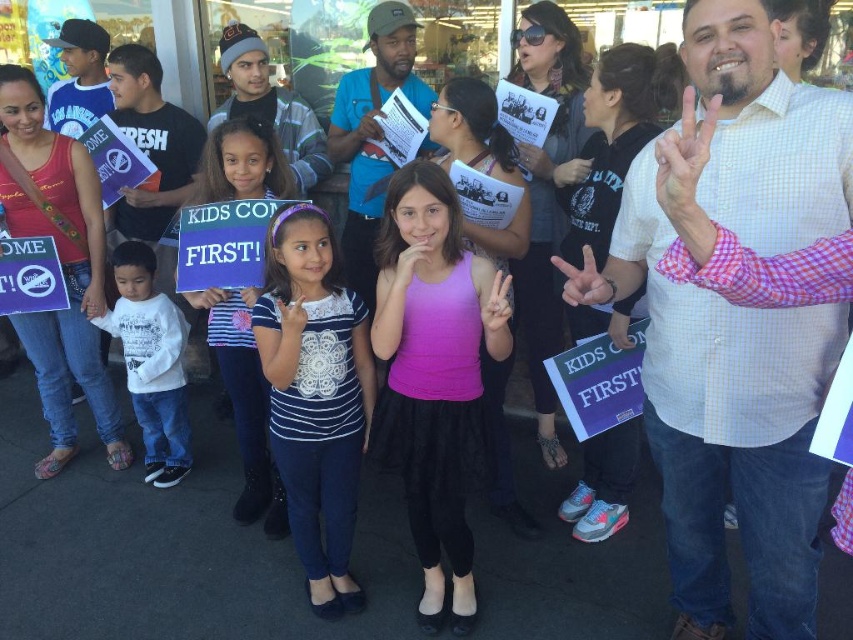
Question: Which of the following is the farthest from the observer?

Choices:
 (A) (331, 348)
 (B) (236, 365)
 (C) (149, 481)

Answer: (C)

Question: Which of these objects is positioned farthest from the striped fabric dress at center?

Choices:
 (A) white cotton shirt at left
 (B) white lace shirt at center

Answer: (A)

Question: Is white lace shirt at center thinner than striped fabric dress at center?

Choices:
 (A) yes
 (B) no

Answer: (B)

Question: Does white lace shirt at center have a greater width compared to striped fabric dress at center?

Choices:
 (A) no
 (B) yes

Answer: (B)

Question: Which object is the closest to the white cotton shirt at left?

Choices:
 (A) striped fabric dress at center
 (B) white lace shirt at center

Answer: (A)

Question: Does white lace shirt at center appear over striped fabric dress at center?

Choices:
 (A) yes
 (B) no

Answer: (A)